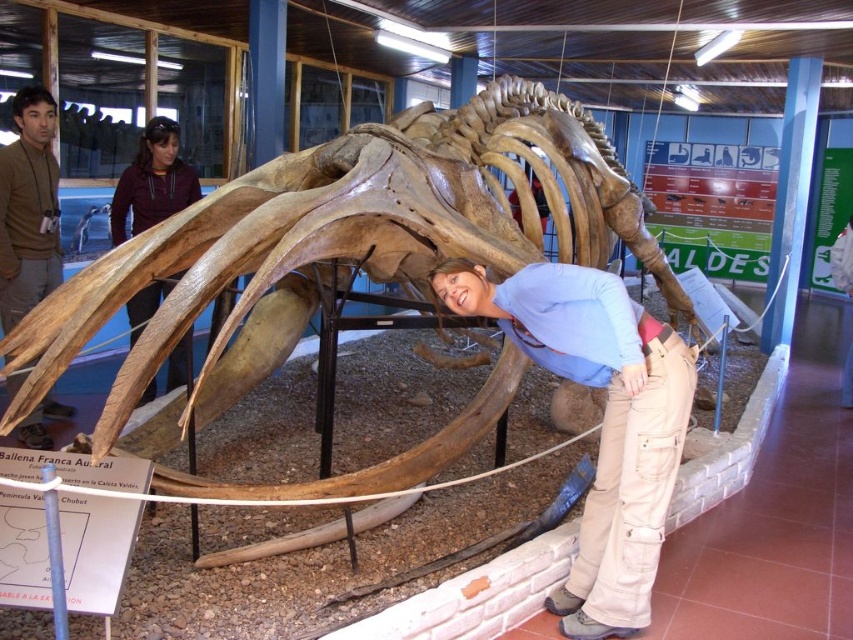
Question: Is beige cotton pants at lower center above dark brown leather jacket at upper left?

Choices:
 (A) no
 (B) yes

Answer: (A)

Question: Is beige cotton pants at lower center positioned before brown leather jacket at upper left?

Choices:
 (A) yes
 (B) no

Answer: (A)

Question: Which point is farther from the camera taking this photo?

Choices:
 (A) (22, 209)
 (B) (117, 209)

Answer: (B)

Question: Does beige cotton pants at lower center appear over dark brown leather jacket at upper left?

Choices:
 (A) yes
 (B) no

Answer: (B)

Question: Considering the real-world distances, which object is closest to the beige cotton pants at lower center?

Choices:
 (A) dark brown leather jacket at upper left
 (B) brown leather jacket at upper left

Answer: (B)

Question: Which object is closer to the camera taking this photo?

Choices:
 (A) brown leather jacket at upper left
 (B) dark brown leather jacket at upper left
 (C) beige cotton pants at lower center

Answer: (C)